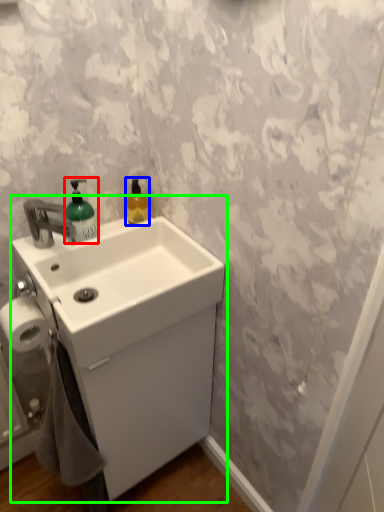
Question: Estimate the real-world distances between objects in this image. Which object is closer to soap dispenser (highlighted by a red box), cleaning product (highlighted by a blue box) or sink (highlighted by a green box)?

Choices:
 (A) cleaning product
 (B) sink

Answer: (A)